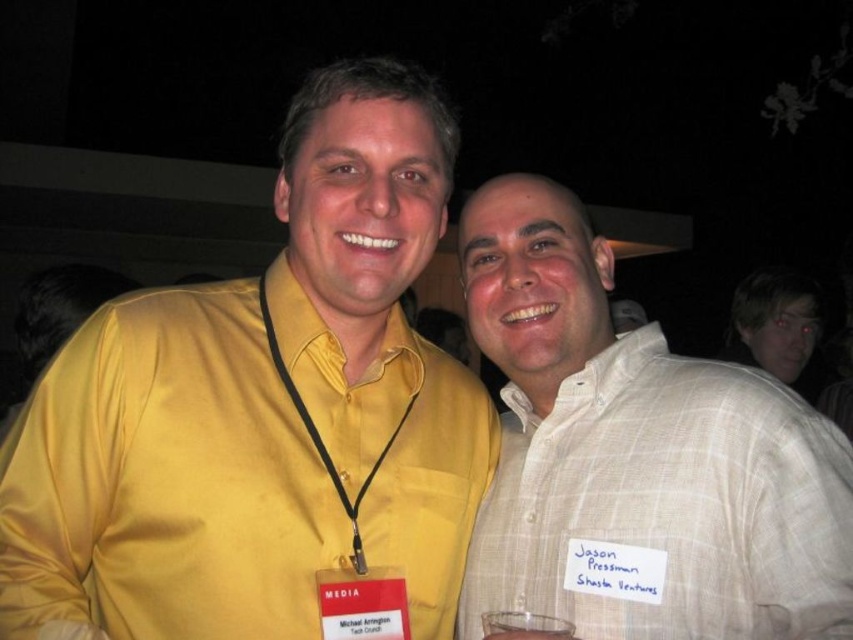
Does white checkered shirt at right have a greater height compared to light brown plaid shirt at right?

Correct, white checkered shirt at right is much taller as light brown plaid shirt at right.

This screenshot has height=640, width=853. In order to click on white checkered shirt at right in this screenshot , I will do `click(637, 456)`.

Is point (486, 508) farther from camera compared to point (727, 355)?

No, it is not.

Where is `white checkered shirt at right`? The width and height of the screenshot is (853, 640). white checkered shirt at right is located at coordinates (637, 456).

Is yellow satin shirt at center further to camera compared to clear glass at lower center?

Yes, it is.

Which is in front, point (84, 444) or point (500, 634)?

Point (500, 634)

The image size is (853, 640). Identify the location of yellow satin shirt at center. (265, 417).

Between point (370, 580) and point (570, 548), which one is positioned behind?

Positioned behind is point (570, 548).

Who is positioned more to the left, yellow satin shirt at center or white checkered shirt at right?

yellow satin shirt at center is more to the left.

Where is `yellow satin shirt at center`? yellow satin shirt at center is located at coordinates (265, 417).

Locate an element on the screen. yellow satin shirt at center is located at coordinates (265, 417).